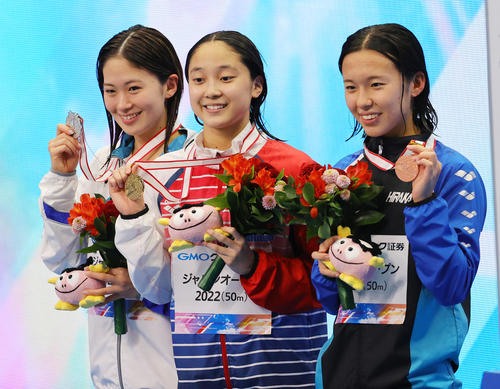
You are a GUI agent. You are given a task and a screenshot of the screen. Output one action in this format:
    pyautogui.click(x=<x>, y=<y>)
    Task: Click on the wall background
    The width and height of the screenshot is (500, 389).
    Given the screenshot: What is the action you would take?
    pyautogui.click(x=65, y=51)